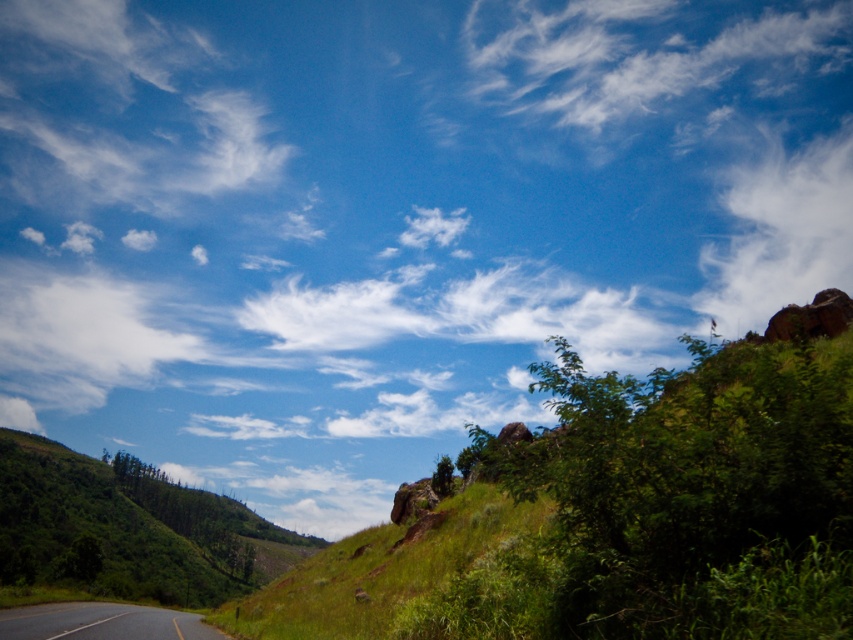
Does white wispy cloud at upper center have a greater width compared to green grassy hillside at lower left?

Yes.

This screenshot has width=853, height=640. In order to click on white wispy cloud at upper center in this screenshot , I will do `click(648, 54)`.

Image resolution: width=853 pixels, height=640 pixels. I want to click on green grassy hillside at lower left, so click(129, 529).

Can you confirm if green grassy hillside at lower left is wider than black asphalt road at lower left?

Correct, the width of green grassy hillside at lower left exceeds that of black asphalt road at lower left.

This screenshot has height=640, width=853. What do you see at coordinates (129, 529) in the screenshot?
I see `green grassy hillside at lower left` at bounding box center [129, 529].

Identify the location of green grassy hillside at lower left. The width and height of the screenshot is (853, 640). (129, 529).

Does white fluffy cloud at upper right come behind black asphalt road at lower left?

Yes, white fluffy cloud at upper right is behind black asphalt road at lower left.

Is white fluffy cloud at upper right above black asphalt road at lower left?

Correct, white fluffy cloud at upper right is located above black asphalt road at lower left.

Between point (776, 189) and point (64, 609), which one is positioned in front?

Point (64, 609)

This screenshot has width=853, height=640. In order to click on white fluffy cloud at upper right in this screenshot , I will do `click(782, 232)`.